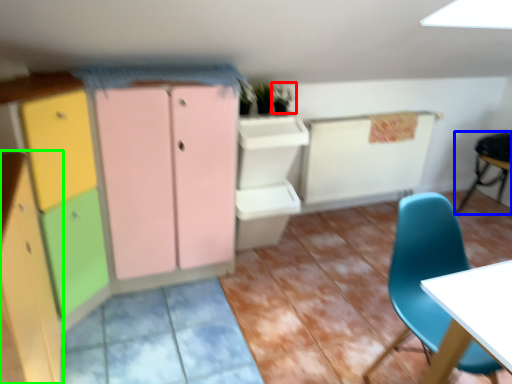
Question: Which object is positioned closest to plant (highlighted by a red box)? Select from chair (highlighted by a blue box) and cabinetry (highlighted by a green box).

Choices:
 (A) chair
 (B) cabinetry

Answer: (B)